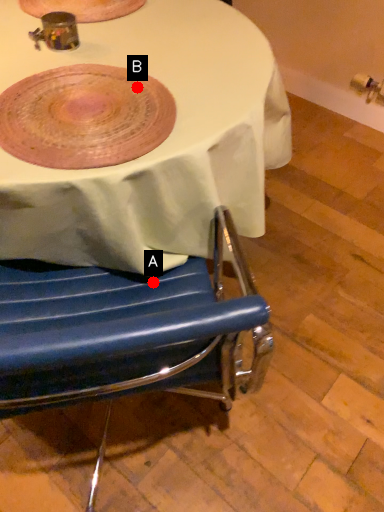
Question: Two points are circled on the image, labeled by A and B beside each circle. Which of the following is the farthest from the observer?

Choices:
 (A) A is further
 (B) B is further

Answer: (A)